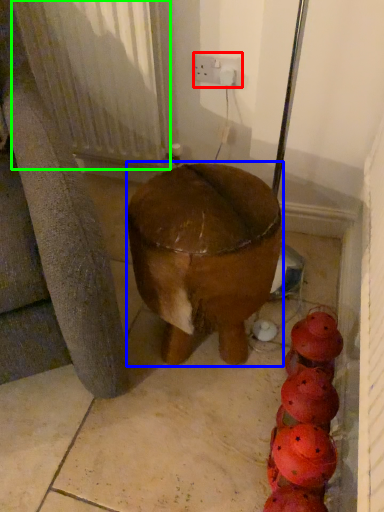
Question: Considering the real-world distances, which object is farthest from electric outlet (highlighted by a red box)? furniture (highlighted by a blue box) or radiator (highlighted by a green box)?

Choices:
 (A) furniture
 (B) radiator

Answer: (A)